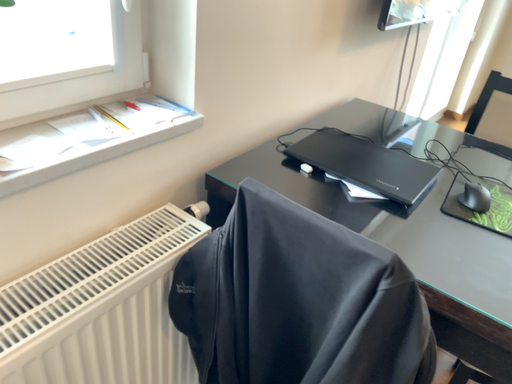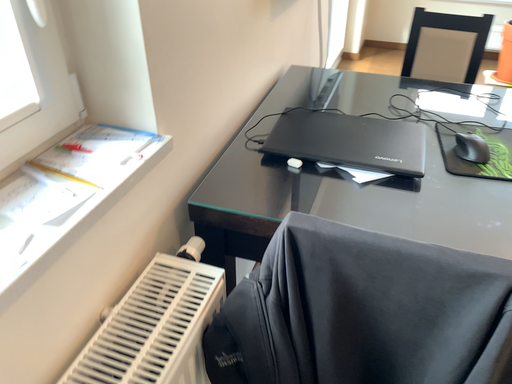
Question: How did the camera likely rotate when shooting the video?

Choices:
 (A) rotated right
 (B) rotated left

Answer: (A)